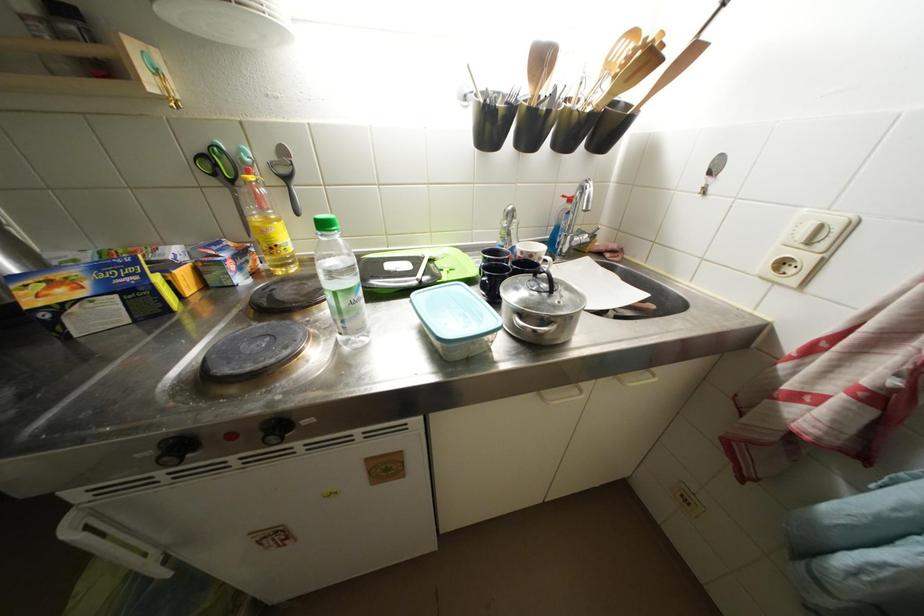
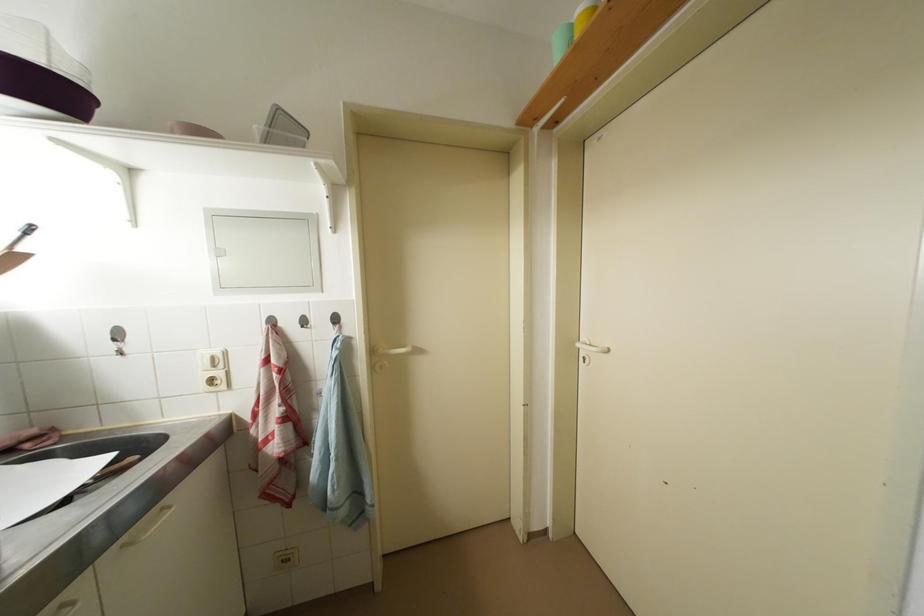
Question: The camera is either moving clockwise (left) or counter-clockwise (right) around the object. The first image is from the beginning of the video and the second image is from the end. Is the camera moving left or right when shooting the video?

Choices:
 (A) Left
 (B) Right

Answer: (A)